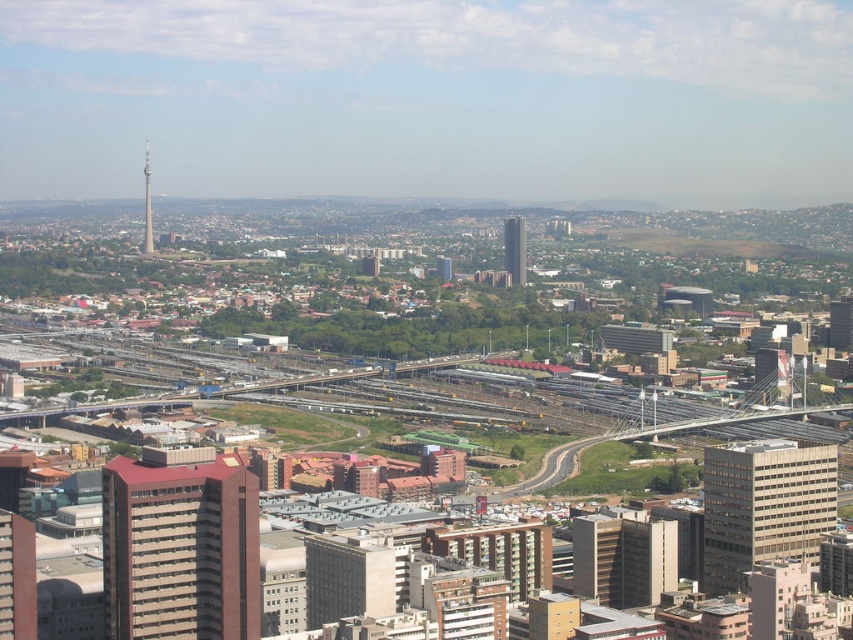
Is beige concrete building at center to the left of shiny metallic tower at upper left from the viewer's perspective?

Incorrect, beige concrete building at center is not on the left side of shiny metallic tower at upper left.

In the scene shown: Can you confirm if beige concrete building at center is positioned to the right of shiny metallic tower at upper left?

Correct, you'll find beige concrete building at center to the right of shiny metallic tower at upper left.

Between point (718, 525) and point (144, 147), which one is positioned behind?

Point (718, 525)

Locate an element on the screen. This screenshot has width=853, height=640. beige concrete building at center is located at coordinates (764, 506).

Consider the image. Is beige concrete building at center to the left of smooth glass skyscraper at center from the viewer's perspective?

Incorrect, beige concrete building at center is not on the left side of smooth glass skyscraper at center.

Between beige concrete building at center and smooth glass skyscraper at center, which one is positioned lower?

beige concrete building at center

Where is `beige concrete building at center`? beige concrete building at center is located at coordinates (764, 506).

Which is behind, point (523, 225) or point (148, 168)?

The point (148, 168) is behind.

Can you confirm if smooth glass skyscraper at center is positioned below shiny metallic tower at upper left?

Correct, smooth glass skyscraper at center is located below shiny metallic tower at upper left.

Is point (515, 276) more distant than point (152, 250)?

No, (515, 276) is closer to viewer.

This screenshot has width=853, height=640. I want to click on smooth glass skyscraper at center, so click(x=514, y=250).